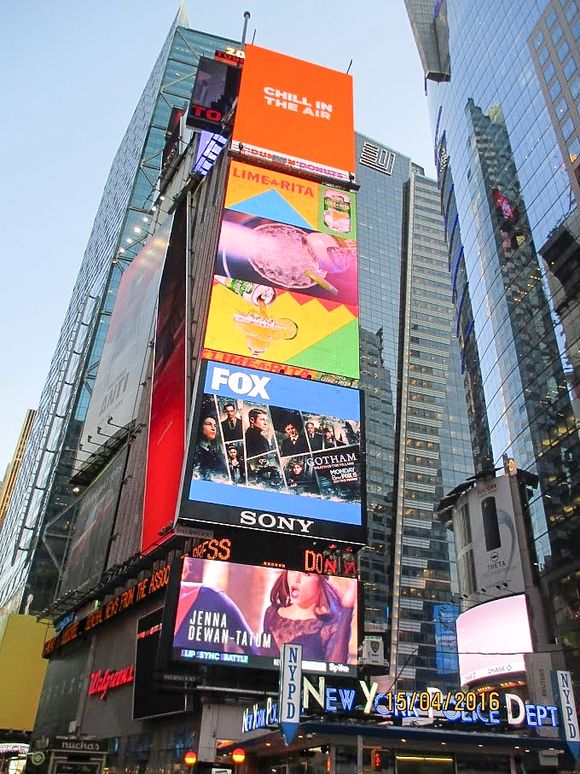
Identify the location of lights. This screenshot has width=580, height=774. coord(238,759), coord(184,762).